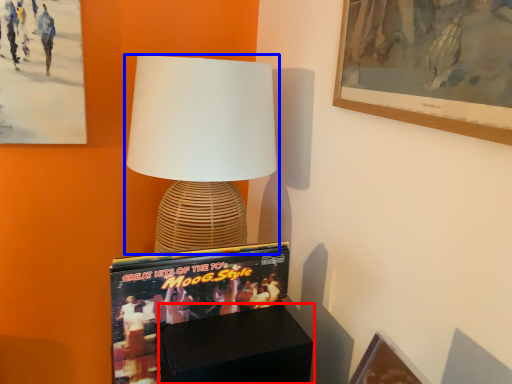
Question: Among these objects, which one is nearest to the camera, furniture (highlighted by a red box) or lamp (highlighted by a blue box)?

Choices:
 (A) furniture
 (B) lamp

Answer: (A)